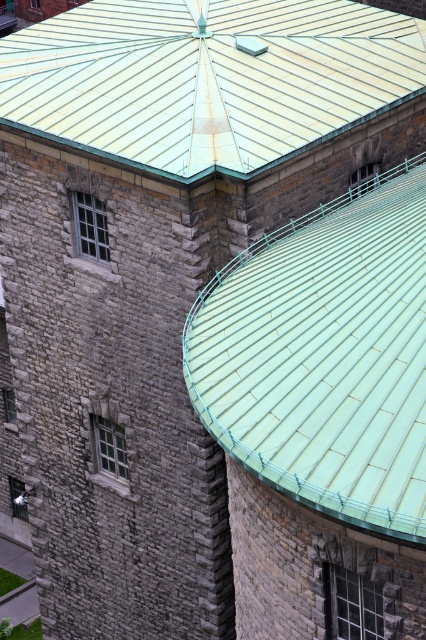
You are an architect examining a building design. You notice a point at coordinates [325,355] on the blueprint. Based on the scene description, what architectural feature does this point most likely correspond to?

The point at coordinates [325,355] corresponds to the green metal tile roof at center, as indicated by the Objects Description.

You are standing in front of the stone building and notice two points on the roof. The first point is at coordinates point (288, 376) and the second is at point (101, 136). Which of these points is closer to your current position?

Point (288, 376) is closer to the camera than point (101, 136), so the first point is closer to your current position.